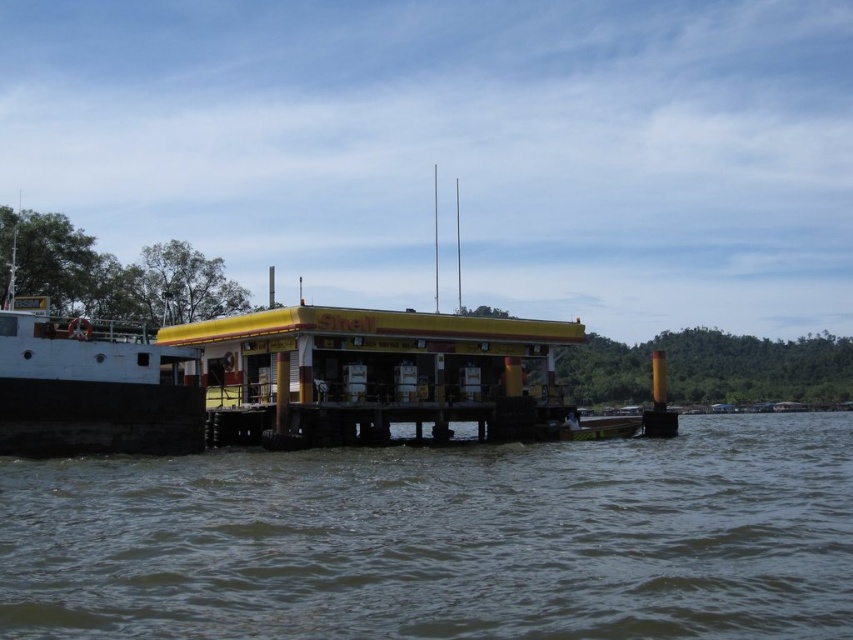
Question: Considering the relative positions of brown murky water at lower center and white matte boat at left in the image provided, where is brown murky water at lower center located with respect to white matte boat at left?

Choices:
 (A) below
 (B) above

Answer: (A)

Question: Which point is closer to the camera taking this photo?

Choices:
 (A) (129, 481)
 (B) (126, 388)

Answer: (A)

Question: Can you confirm if brown murky water at lower center is bigger than white matte boat at left?

Choices:
 (A) no
 (B) yes

Answer: (A)

Question: Which point is farther to the camera?

Choices:
 (A) (136, 339)
 (B) (741, 550)

Answer: (A)

Question: Can you confirm if brown murky water at lower center is thinner than white matte boat at left?

Choices:
 (A) yes
 (B) no

Answer: (B)